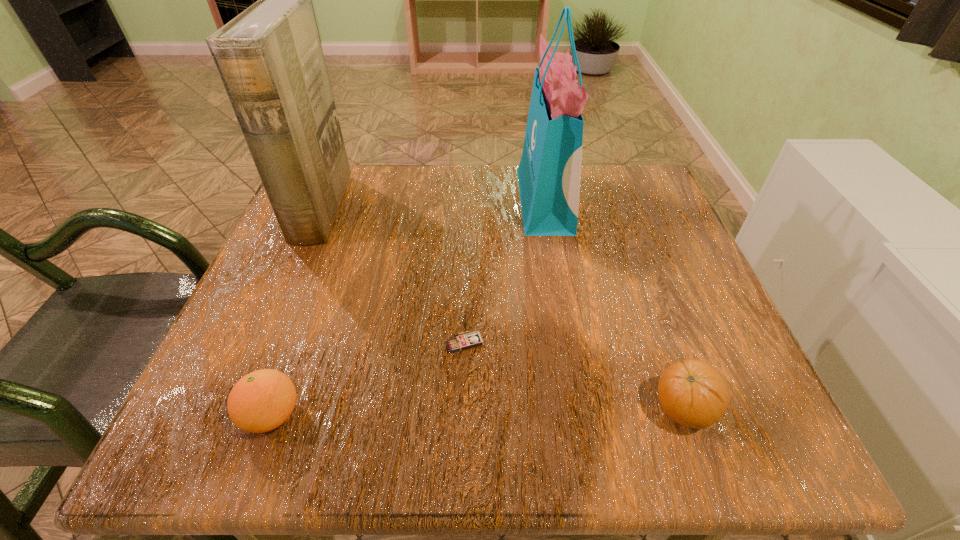
Find the location of a particular element. The width and height of the screenshot is (960, 540). unoccupied position between the right orange and the phonebook is located at coordinates (502, 309).

What are the coordinates of `vacant space that's between the left orange and the third nearest object` in the screenshot? It's located at click(x=369, y=379).

At what (x,y) coordinates should I click in order to perform the action: click on empty location between the rightmost object and the third object from left to right. Please return your answer as a coordinate pair (x, y). This screenshot has width=960, height=540. Looking at the image, I should click on (574, 376).

You are a GUI agent. You are given a task and a screenshot of the screen. Output one action in this format:
    pyautogui.click(x=<x>, y=<y>)
    Task: Click on the vacant region between the second object from right to left and the rightmost object
    Image resolution: width=960 pixels, height=540 pixels.
    Given the screenshot: What is the action you would take?
    pyautogui.click(x=613, y=306)

This screenshot has width=960, height=540. Find the location of `blank region between the phonebook and the second object from right to left`. blank region between the phonebook and the second object from right to left is located at coordinates pyautogui.click(x=433, y=205).

The width and height of the screenshot is (960, 540). Identify the location of the fourth closest object to the right orange. (270, 60).

Identify the location of the closest object to the phonebook. This screenshot has height=540, width=960. (262, 400).

You are a GUI agent. You are given a task and a screenshot of the screen. Output one action in this format:
    pyautogui.click(x=<x>, y=<y>)
    Task: Click on the free space that satisfies the following two spatial constraints: 1. on the cover of the phonebook; 2. on the left side of the rightmost object
    The width and height of the screenshot is (960, 540).
    Given the screenshot: What is the action you would take?
    pyautogui.click(x=236, y=409)

The width and height of the screenshot is (960, 540). In order to click on free region that satisfies the following two spatial constraints: 1. on the front side of the matchbox; 2. on the left side of the right orange in this screenshot , I will do `click(463, 409)`.

This screenshot has height=540, width=960. Find the location of `free space that satisfies the following two spatial constraints: 1. on the cover of the phonebook; 2. on the left side of the right orange`. free space that satisfies the following two spatial constraints: 1. on the cover of the phonebook; 2. on the left side of the right orange is located at coordinates (236, 409).